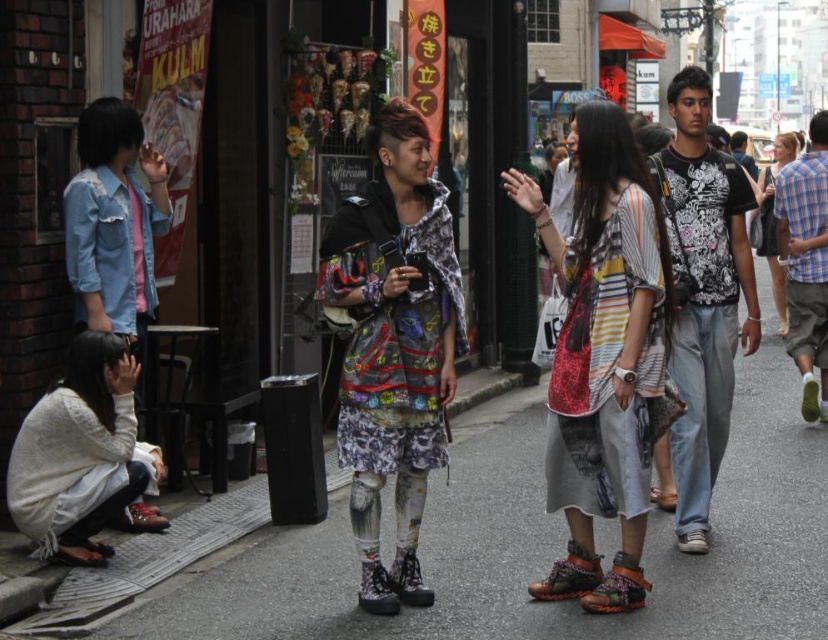
Question: Does printed fabric dress at center have a larger size compared to white knitted sweater at lower left?

Choices:
 (A) no
 (B) yes

Answer: (B)

Question: Which object appears closest to the camera in this image?

Choices:
 (A) striped cotton shirt at center
 (B) leather textured sandal at lower center
 (C) printed fabric dress at center

Answer: (A)

Question: Does matte concrete pavement at center appear over brown leather sandal at lower left?

Choices:
 (A) no
 (B) yes

Answer: (A)

Question: From the image, what is the correct spatial relationship of camouflage fabric sandal at lower center in relation to leather sandal at lower left?

Choices:
 (A) left
 (B) right

Answer: (B)

Question: Estimate the real-world distances between objects in this image. Which object is farther from the camouflage fabric sandal at lower center?

Choices:
 (A) striped cotton shirt at center
 (B) brown leather sandal at lower left

Answer: (B)

Question: Which of the following is the farthest from the observer?

Choices:
 (A) white knitted sweater at lower left
 (B) brown leather sandal at lower left
 (C) printed fabric dress at center

Answer: (B)